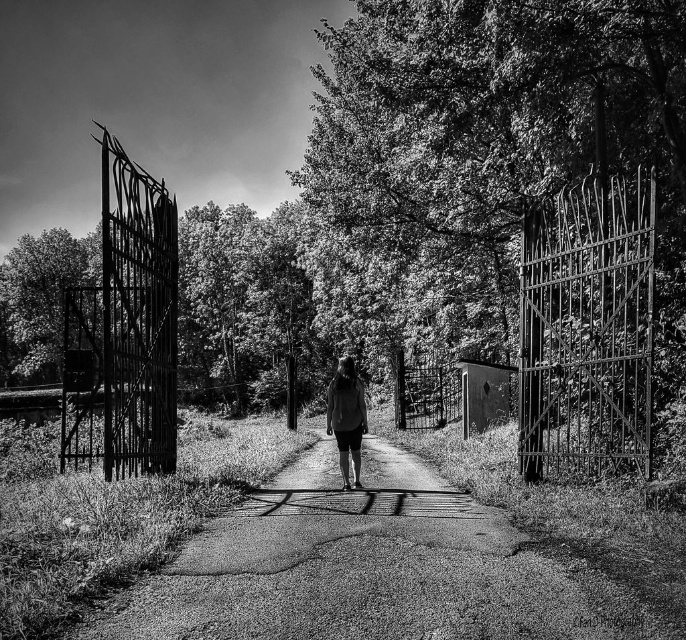
Consider the image. You are standing at the entrance of a path and see the rusty metal gate at right and the smooth bark tree at left. Which object is located to the right of the other?

The rusty metal gate at right is positioned on the right side of smooth bark tree at left.

Based on the coordinates provided in the scene description, where is the green leafy tree at center located?

The green leafy tree at center is located at point (528,186).

You are a photographer trying to capture the smooth bark tree at left and the matte gray shirt at center in the same frame. Based on their positions, which object should you focus on first to ensure both are in focus?

The smooth bark tree at left is located above the matte gray shirt at center, so you should focus on the smooth bark tree at left first to ensure both are in focus.